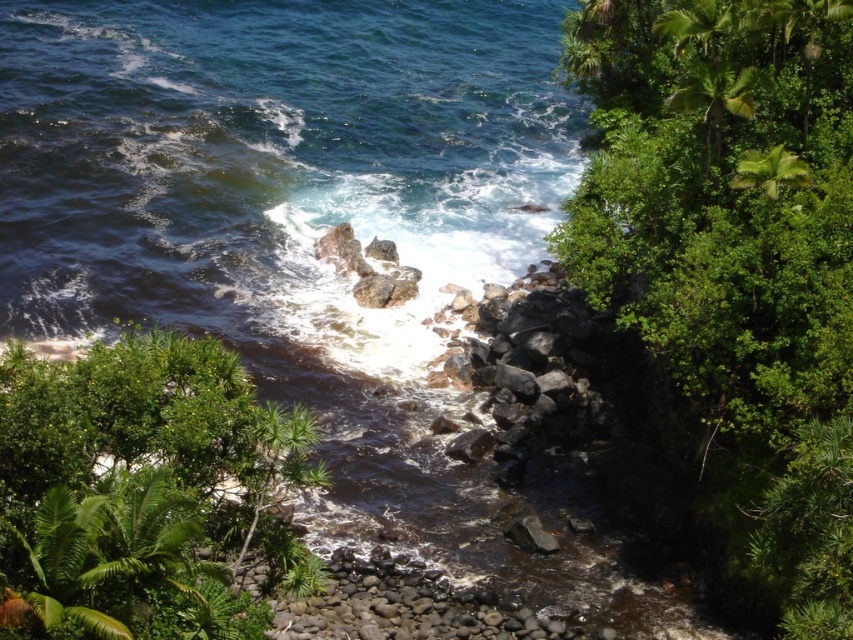
Question: Among these points, which one is farthest from the camera?

Choices:
 (A) (682, 269)
 (B) (48, 392)

Answer: (A)

Question: Is green leafy shrubs at right below green leafy shrub at lower left?

Choices:
 (A) no
 (B) yes

Answer: (A)

Question: Does green leafy shrubs at right come in front of green leafy shrub at lower left?

Choices:
 (A) no
 (B) yes

Answer: (A)

Question: Is green leafy shrubs at right positioned in front of green leafy shrub at lower left?

Choices:
 (A) yes
 (B) no

Answer: (B)